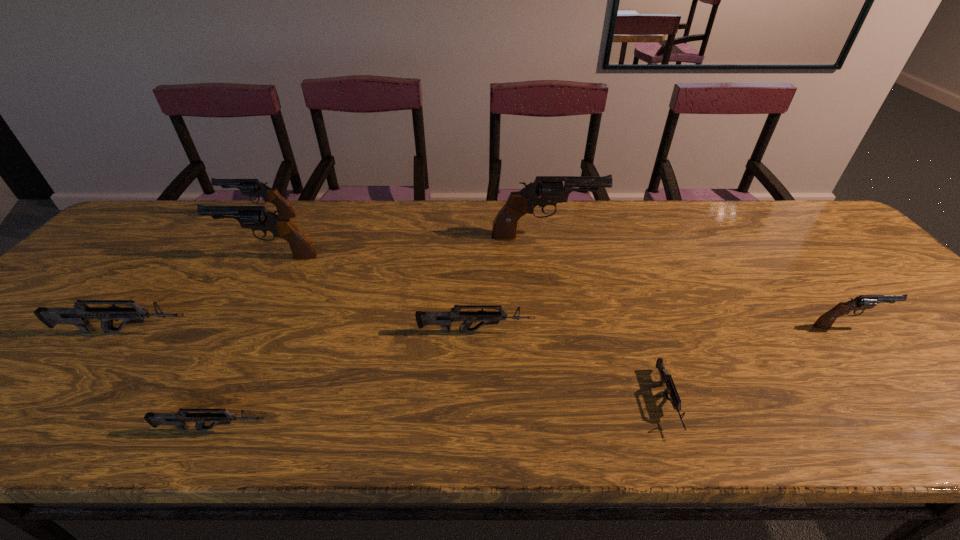
You are a GUI agent. You are given a task and a screenshot of the screen. Output one action in this format:
    pyautogui.click(x=<x>, y=<y>)
    Task: Click on the third shortest object
    
    Given the screenshot: What is the action you would take?
    pyautogui.click(x=442, y=318)

At what (x,y) coordinates should I click in order to perform the action: click on the second shortest gun. Please return your answer as a coordinate pair (x, y). Image resolution: width=960 pixels, height=540 pixels. Looking at the image, I should click on (179, 419).

Find the location of a particular element. The width and height of the screenshot is (960, 540). the second shortest object is located at coordinates (179, 419).

This screenshot has height=540, width=960. Identify the location of the seventh object from left to right. (666, 378).

At what (x,y) coordinates should I click in order to perform the action: click on the shortest gun. Please return your answer as a coordinate pair (x, y). Image resolution: width=960 pixels, height=540 pixels. Looking at the image, I should click on pyautogui.click(x=666, y=378).

Where is `free spot located along the barrel of the biggest black gun`? The height and width of the screenshot is (540, 960). free spot located along the barrel of the biggest black gun is located at coordinates (655, 237).

The image size is (960, 540). I want to click on free space located 0.310m along the barrel of the third smallest black gun, so click(109, 256).

I want to click on vacant space positioned 0.100m along the barrel of the third smallest black gun, so click(x=184, y=256).

Locate an element on the screen. Image resolution: width=960 pixels, height=540 pixels. vacant space located 0.270m along the barrel of the third smallest black gun is located at coordinates (124, 256).

You are a GUI agent. You are given a task and a screenshot of the screen. Output one action in this format:
    pyautogui.click(x=<x>, y=<y>)
    Task: Click on the free space located along the barrel of the sixth shortest object
    Image resolution: width=960 pixels, height=540 pixels.
    Given the screenshot: What is the action you would take?
    pyautogui.click(x=192, y=217)